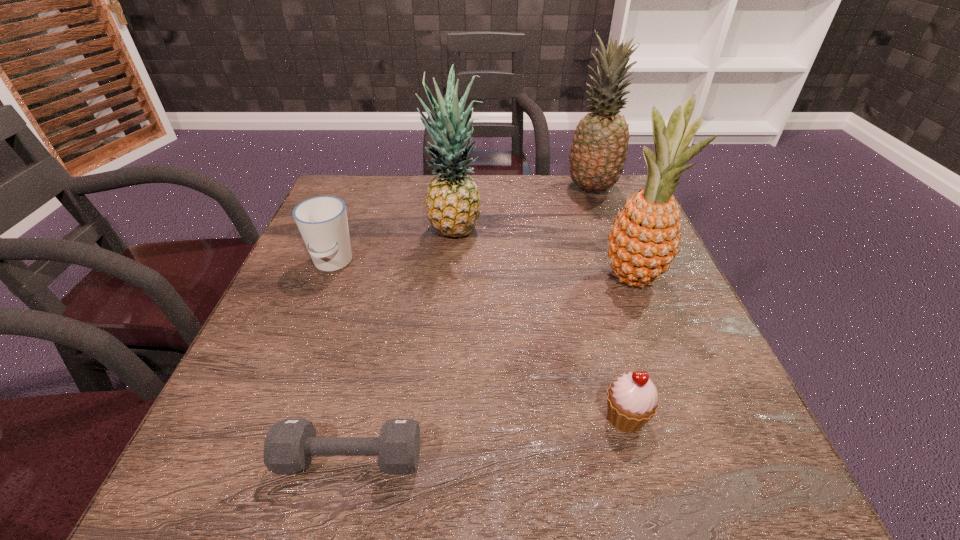
Image resolution: width=960 pixels, height=540 pixels. What are the coordinates of `free space at the left edge of the desktop` in the screenshot? It's located at (309, 328).

This screenshot has height=540, width=960. In the image, there is a desktop. Identify the location of vacant space at the right edge. (652, 375).

The image size is (960, 540). Find the location of `vacant area at the near left corner`. vacant area at the near left corner is located at coordinates (232, 497).

Locate an element on the screen. This screenshot has height=540, width=960. free space at the far right corner of the desktop is located at coordinates point(629,189).

Locate an element on the screen. The width and height of the screenshot is (960, 540). free space at the near right corner is located at coordinates (732, 481).

Locate an element on the screen. The height and width of the screenshot is (540, 960). empty space that is in between the farthest pineapple and the shortest object is located at coordinates (470, 323).

This screenshot has width=960, height=540. I want to click on empty location between the nearest pineapple and the leftmost pineapple, so click(544, 255).

Find the location of `free point between the cupcake and the third shortest object`. free point between the cupcake and the third shortest object is located at coordinates (479, 340).

What are the coordinates of `empty space that is in between the shortest object and the cup` in the screenshot? It's located at (341, 360).

What are the coordinates of `blank region between the nearest pineapple and the leftmost pineapple` in the screenshot? It's located at (544, 255).